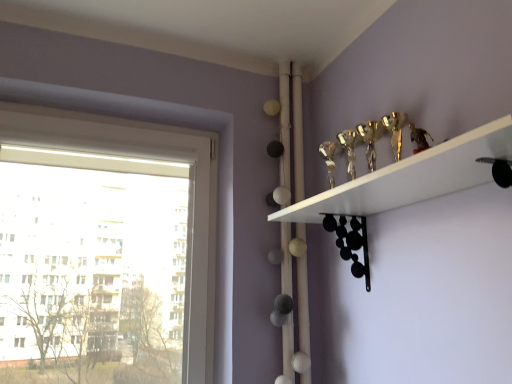
Question: Relative to white plastic window at left, is gold metallic trophy at upper right in front or behind?

Choices:
 (A) front
 (B) behind

Answer: (A)

Question: In terms of height, does gold metallic trophy at upper right look taller or shorter compared to white plastic window at left?

Choices:
 (A) short
 (B) tall

Answer: (A)

Question: Considering the positions of gold metallic trophy at upper right and white plastic window at left in the image, is gold metallic trophy at upper right wider or thinner than white plastic window at left?

Choices:
 (A) wide
 (B) thin

Answer: (A)

Question: Visually, is white plastic window at left positioned to the left or to the right of gold metallic trophy at upper right?

Choices:
 (A) left
 (B) right

Answer: (A)

Question: Considering the positions of white plastic window at left and gold metallic trophy at upper right in the image, is white plastic window at left wider or thinner than gold metallic trophy at upper right?

Choices:
 (A) wide
 (B) thin

Answer: (B)

Question: From a real-world perspective, is white plastic window at left physically located above or below gold metallic trophy at upper right?

Choices:
 (A) above
 (B) below

Answer: (A)

Question: Considering the positions of point (70, 119) and point (401, 175), is point (70, 119) closer or farther from the camera than point (401, 175)?

Choices:
 (A) farther
 (B) closer

Answer: (A)